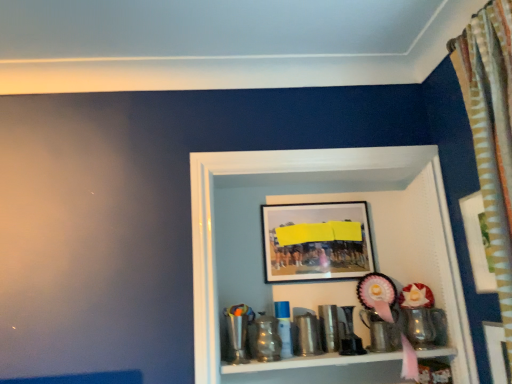
Question: Is metallic trophy at center far from metallic shiny cup at lower center, the second toy viewed from the right?

Choices:
 (A) no
 (B) yes

Answer: (A)

Question: Would you say metallic trophy at center is outside metallic shiny cup at lower center, the second toy viewed from the right?

Choices:
 (A) yes
 (B) no

Answer: (A)

Question: Is metallic trophy at center smaller than metallic shiny cup at lower center, the second toy viewed from the right?

Choices:
 (A) yes
 (B) no

Answer: (B)

Question: Does metallic trophy at center lie in front of metallic shiny cup at lower center, which is the first toy in left-to-right order?

Choices:
 (A) yes
 (B) no

Answer: (A)

Question: Is metallic trophy at center to the left of metallic shiny cup at lower center, which is the first toy in left-to-right order, from the viewer's perspective?

Choices:
 (A) yes
 (B) no

Answer: (B)

Question: Is metallic shiny cup at lower center, which is the first toy in left-to-right order, a part of metallic trophy at center?

Choices:
 (A) yes
 (B) no

Answer: (A)

Question: Would you say matte black picture frame at upper center, the first picture frame when ordered from back to front, contains wooden picture frame at upper right, marked as the 2th picture frame in a back-to-front arrangement?

Choices:
 (A) yes
 (B) no

Answer: (B)

Question: Is matte black picture frame at upper center, the first picture frame when ordered from back to front, positioned before wooden picture frame at upper right, marked as the 2th picture frame in a back-to-front arrangement?

Choices:
 (A) no
 (B) yes

Answer: (A)

Question: Is matte black picture frame at upper center, the first picture frame viewed from the left, oriented away from wooden picture frame at upper right, marked as the 2th picture frame in a left-to-right arrangement?

Choices:
 (A) yes
 (B) no

Answer: (B)

Question: Is matte black picture frame at upper center, arranged as the second picture frame when viewed from the right, thinner than wooden picture frame at upper right, positioned as the first picture frame in right-to-left order?

Choices:
 (A) no
 (B) yes

Answer: (A)

Question: Is matte black picture frame at upper center, the first picture frame when ordered from back to front, completely or partially outside of wooden picture frame at upper right, marked as the 2th picture frame in a back-to-front arrangement?

Choices:
 (A) no
 (B) yes

Answer: (B)

Question: Is matte black picture frame at upper center, the first picture frame when ordered from back to front, behind wooden picture frame at upper right, marked as the 2th picture frame in a left-to-right arrangement?

Choices:
 (A) no
 (B) yes

Answer: (B)

Question: Is metallic silver cup at lower right, which is counted as the second toy, starting from the left, not close to wooden picture frame at upper right, marked as the 2th picture frame in a back-to-front arrangement?

Choices:
 (A) no
 (B) yes

Answer: (A)